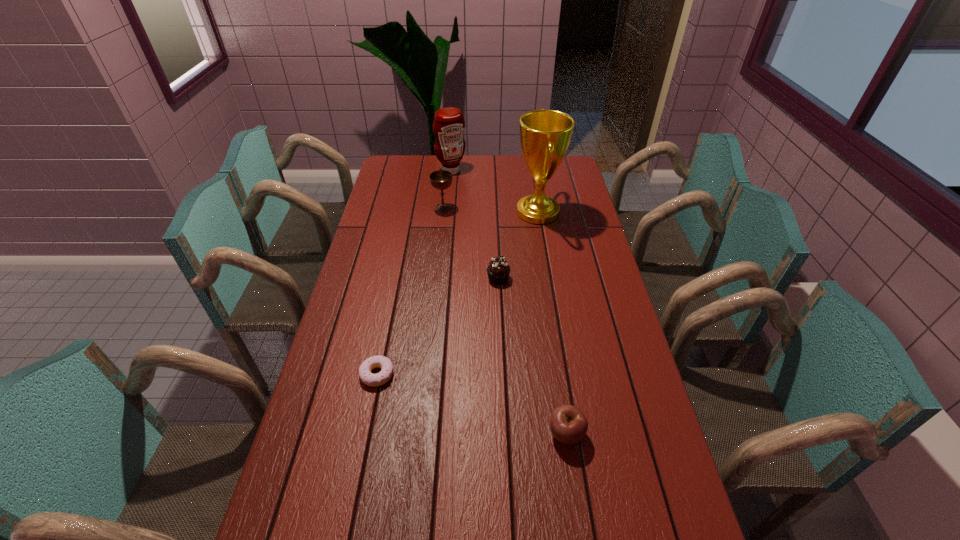
Where is `award`? This screenshot has width=960, height=540. award is located at coordinates (545, 135).

Where is `condiment`? This screenshot has width=960, height=540. condiment is located at coordinates (448, 125).

Locate an element on the screen. This screenshot has width=960, height=540. the second tallest object is located at coordinates (448, 125).

Where is `chalice`? This screenshot has width=960, height=540. chalice is located at coordinates click(x=441, y=179).

Find the location of a particular element. Image resolution: width=960 pixels, height=540 pixels. the third object from right to left is located at coordinates (498, 270).

Identify the location of the fourth farthest object. (498, 270).

Where is `apple`? apple is located at coordinates (568, 424).

Find the location of a particular element. The image size is (960, 540). the leftmost object is located at coordinates (368, 378).

The height and width of the screenshot is (540, 960). I want to click on the fifth farthest object, so click(x=368, y=378).

This screenshot has width=960, height=540. In order to click on vacant region located by the handles of the tallest object in this screenshot , I will do `click(420, 212)`.